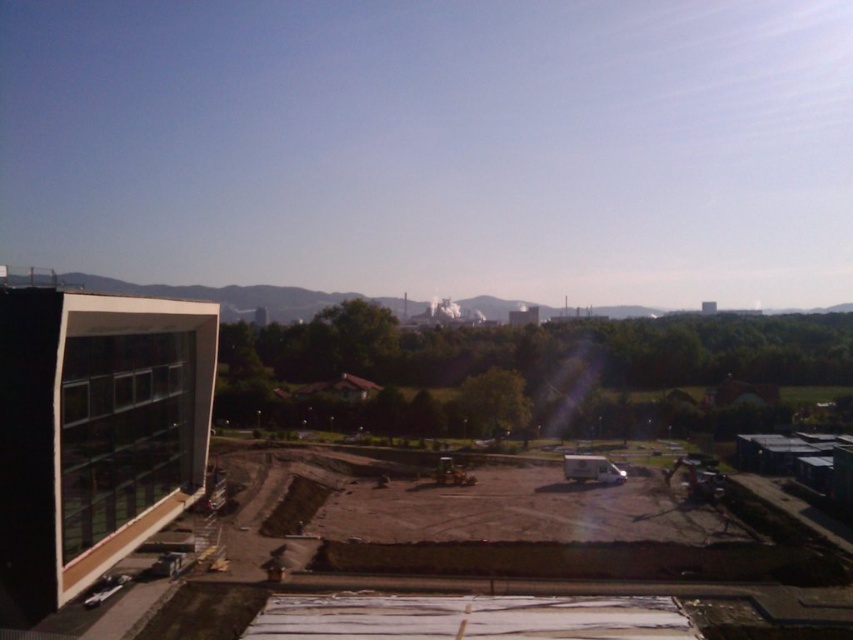
You are a construction worker standing at the entrance of the partially constructed building. You need to reach the brown dirt at center marked by point (x=97, y=429). Which direction should you walk from your current position to reach it?

The brown dirt at center is located at point (x=97, y=429), so you should walk towards the center of the construction site from the entrance of the partially constructed building to reach it.

You are a delivery driver who needs to park your truck in the construction site. The truck requires a large flat area to park. Based on the scene, which location would be more suitable for parking your truck? The brown dirt at center or the matte glass building at left?

The brown dirt at center is bigger than the matte glass building at left, so the brown dirt at center would be more suitable for parking the truck as it provides a larger flat area.

You are a delivery driver who needs to park your truck near the construction site. The truck requires a flat surface to park safely. Based on the scene, which area between the brown dirt at center and the matte glass building at left would be more suitable for parking?

The matte glass building at left is positioned to the left of the brown dirt at center. Since the brown dirt at center is on the right side of the matte glass building at left, the area near the matte glass building at left might have a flatter surface compared to the uneven brown dirt at center, making it more suitable for parking the truck safely.